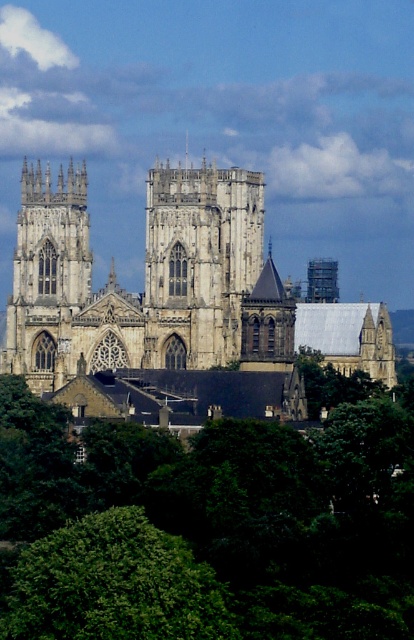
Between green leafy tree at lower left and white stone tower at center, which one is positioned higher?

white stone tower at center is above.

Does green leafy tree at lower left appear over white stone tower at center?

Incorrect, green leafy tree at lower left is not positioned above white stone tower at center.

Where is `green leafy tree at lower left`? green leafy tree at lower left is located at coordinates (113, 584).

Is green leafy tree at lower center thinner than green leafy tree at lower left?

No.

Is point (260, 436) closer to viewer compared to point (197, 637)?

No.

Which is in front, point (43, 563) or point (201, 592)?

Point (201, 592)

Locate an element on the screen. This screenshot has height=640, width=414. green leafy tree at lower center is located at coordinates [x=206, y=525].

The height and width of the screenshot is (640, 414). In order to click on green leafy tree at lower center in this screenshot , I will do `click(206, 525)`.

Can you confirm if green leafy tree at lower center is positioned below white stone tower at center?

Correct, green leafy tree at lower center is located below white stone tower at center.

I want to click on green leafy tree at lower center, so click(x=206, y=525).